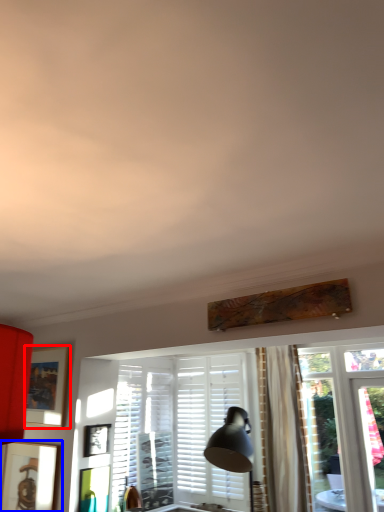
Question: Which of the following is the farthest to the observer, picture frame (highlighted by a red box) or picture frame (highlighted by a blue box)?

Choices:
 (A) picture frame
 (B) picture frame

Answer: (A)